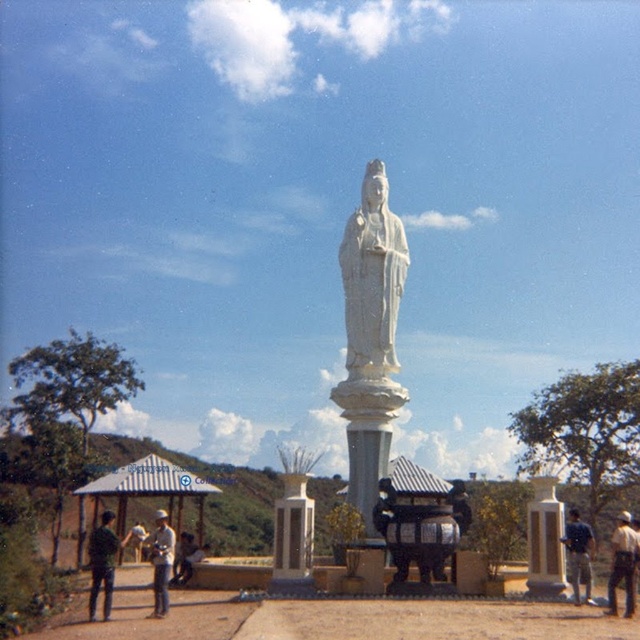
Is point (365, 451) positioned after point (156, 582)?

That is True.

Is white marble pillar at center to the left of light blue jeans at center from the viewer's perspective?

Incorrect, white marble pillar at center is not on the left side of light blue jeans at center.

Locate an element on the screen. This screenshot has height=640, width=640. white marble pillar at center is located at coordinates (365, 465).

Where is `white marble pillar at center`? white marble pillar at center is located at coordinates pos(365,465).

Is point (364, 483) more distant than point (588, 534)?

That is True.

This screenshot has width=640, height=640. Describe the element at coordinates (365, 465) in the screenshot. I see `white marble pillar at center` at that location.

The height and width of the screenshot is (640, 640). What are the coordinates of `white marble pillar at center` in the screenshot? It's located at (365, 465).

Who is lower down, light blue jeans at center or blue fabric shirt at lower right?

light blue jeans at center is lower down.

Where is `light blue jeans at center`? This screenshot has height=640, width=640. light blue jeans at center is located at coordinates (161, 561).